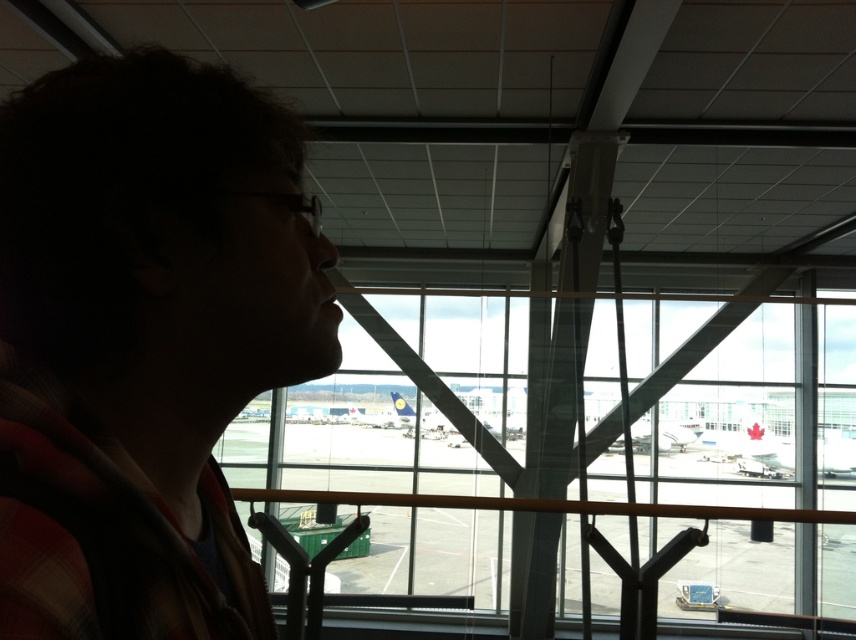
Does plaid fabric at left appear on the right side of transparent glass window at center?

Incorrect, plaid fabric at left is not on the right side of transparent glass window at center.

Is point (15, 637) closer to viewer compared to point (482, 333)?

Yes, point (15, 637) is in front of point (482, 333).

Is point (21, 627) positioned after point (825, 593)?

No, it is not.

Find the location of a particular element. plaid fabric at left is located at coordinates [144, 340].